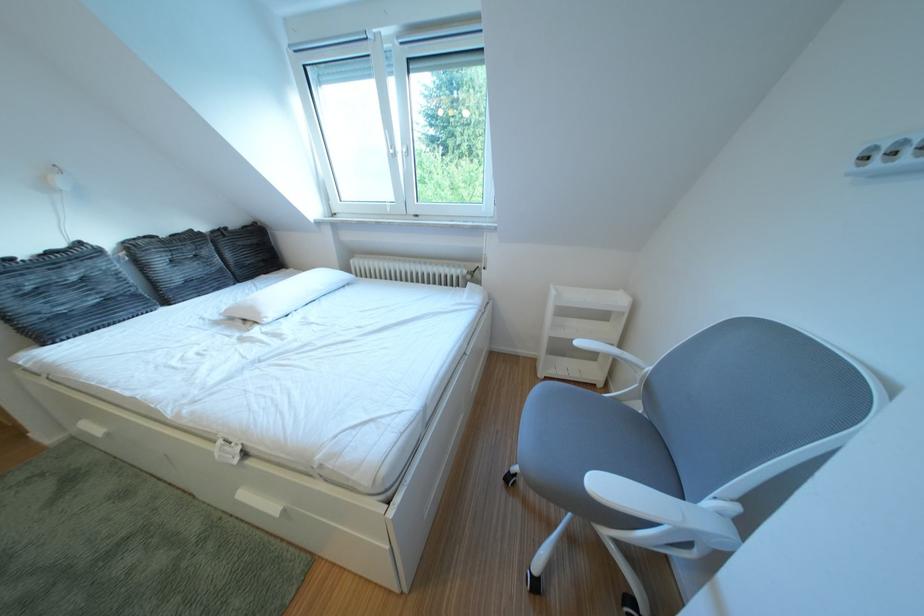
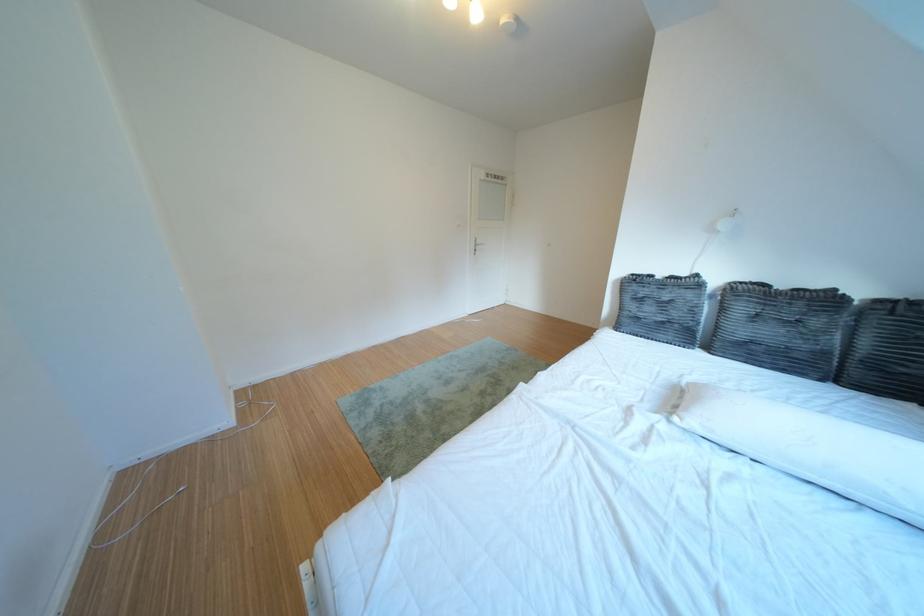
Where in the second image is the point corresponding to (233,235) from the first image?

(910, 306)